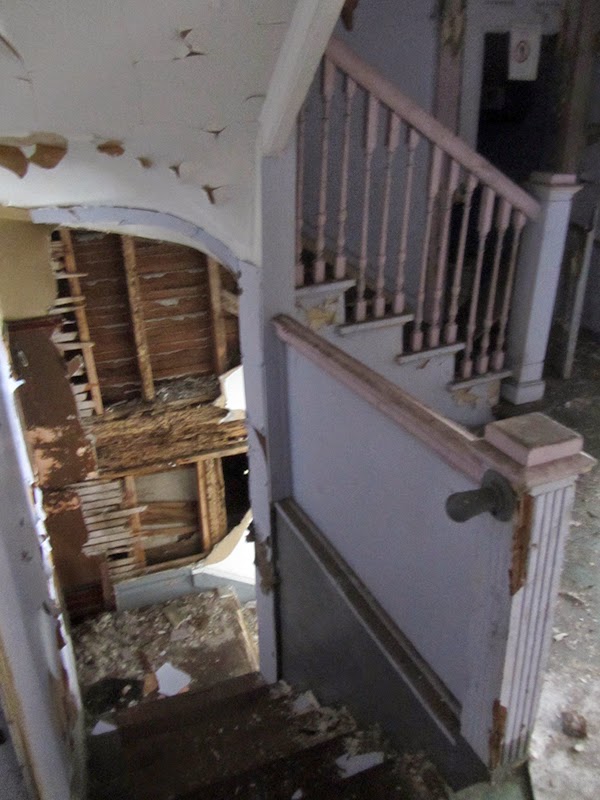
Locate an element on the screen. doorway is located at coordinates (475, 105).